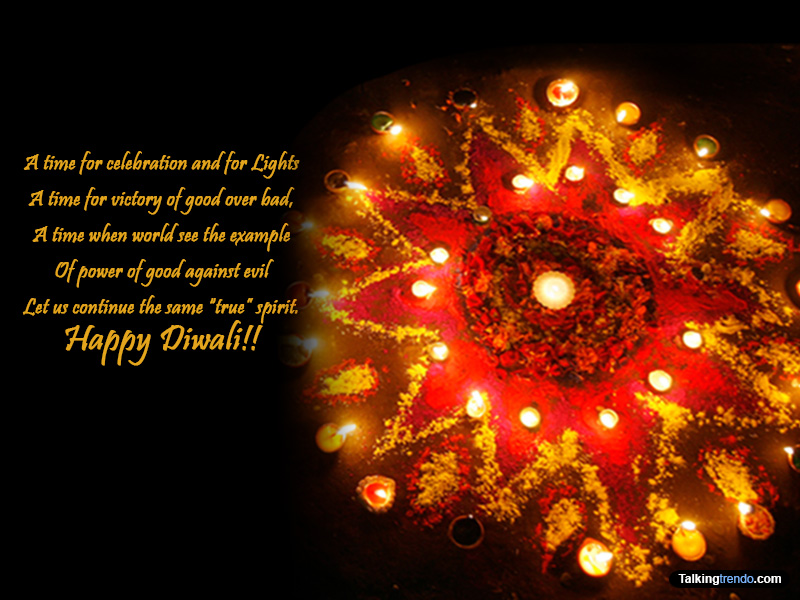
Identify the location of candles. The height and width of the screenshot is (600, 800). (494, 418).